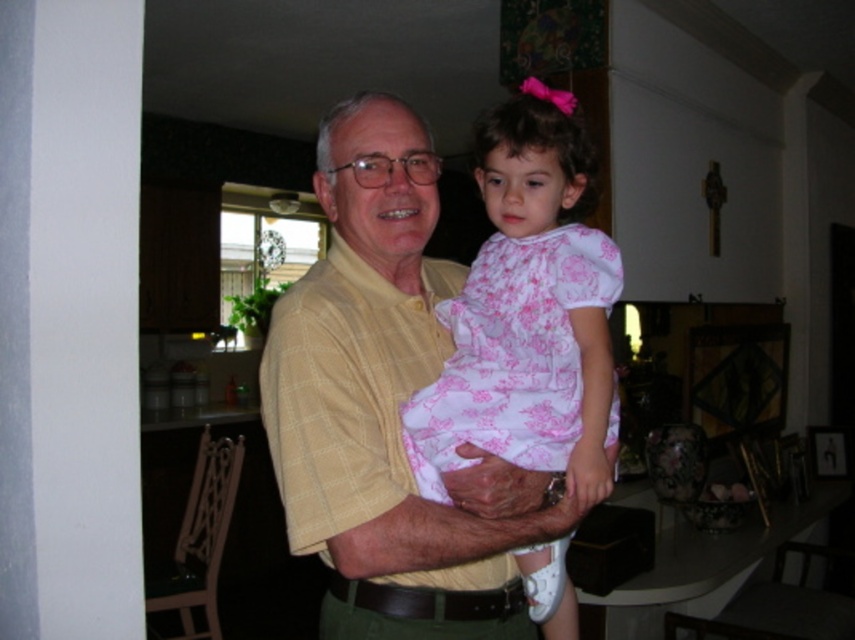
Question: Which of the following is the closest to the observer?

Choices:
 (A) (611, 396)
 (B) (440, 620)

Answer: (B)

Question: Does yellow checkered shirt at center have a lesser width compared to pink floral dress at center?

Choices:
 (A) yes
 (B) no

Answer: (B)

Question: Can you confirm if yellow checkered shirt at center is smaller than pink floral dress at center?

Choices:
 (A) no
 (B) yes

Answer: (A)

Question: From the image, what is the correct spatial relationship of yellow checkered shirt at center in relation to pink floral dress at center?

Choices:
 (A) left
 (B) right

Answer: (A)